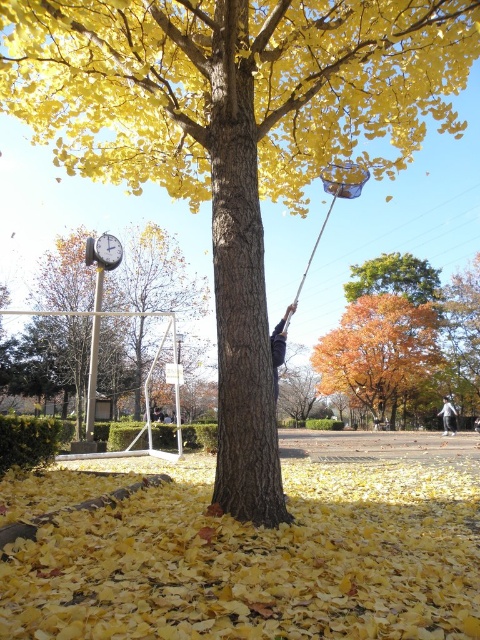
Question: Among these objects, which one is nearest to the camera?

Choices:
 (A) silver metallic helmet at center
 (B) dark gray fabric at tree trunk

Answer: (B)

Question: From the image, what is the correct spatial relationship of smooth yellow leaves at center in relation to silver metallic helmet at center?

Choices:
 (A) above
 (B) below

Answer: (A)

Question: Is orange autumn leaves at center in front of metallic gray clock at upper left?

Choices:
 (A) yes
 (B) no

Answer: (B)

Question: Does orange autumn leaves at center come in front of metallic gray clock at upper left?

Choices:
 (A) yes
 (B) no

Answer: (B)

Question: Which object is positioned closest to the silver metallic helmet at center?

Choices:
 (A) dark gray fabric at tree trunk
 (B) metallic gray clock at upper left

Answer: (B)

Question: Estimate the real-world distances between objects in this image. Which object is farther from the metallic gray clock at upper left?

Choices:
 (A) orange autumn leaves at center
 (B) smooth yellow leaves at center
 (C) silver metallic helmet at center

Answer: (A)